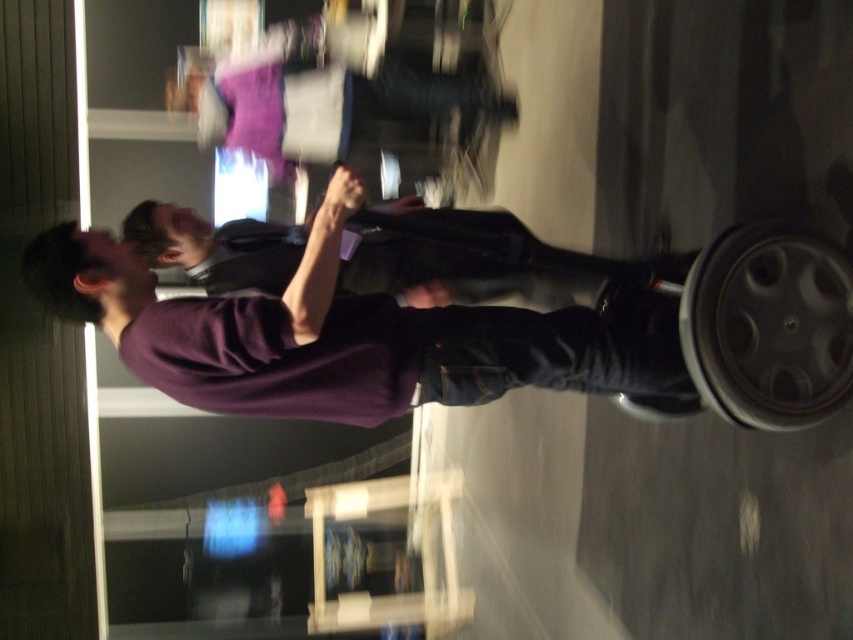
Who is positioned more to the right, purple matte shirt at center or purple matte sweater at center?

purple matte sweater at center is more to the right.

Does point (521, 355) come closer to viewer compared to point (601, 264)?

Yes, it is in front of point (601, 264).

Is point (477, 355) positioned before point (413, 225)?

Yes, point (477, 355) is in front of point (413, 225).

Image resolution: width=853 pixels, height=640 pixels. Identify the location of purple matte shirt at center. (334, 339).

Is purple matte shirt at center shorter than transparent plastic lift at lower center?

Yes.

Which is in front, point (291, 280) or point (320, 620)?

Point (291, 280) is in front.

Where is `purple matte shirt at center`? The width and height of the screenshot is (853, 640). purple matte shirt at center is located at coordinates (334, 339).

In order to click on purple matte sweater at center in this screenshot , I will do `click(482, 257)`.

Image resolution: width=853 pixels, height=640 pixels. In order to click on purple matte sweater at center in this screenshot , I will do `click(482, 257)`.